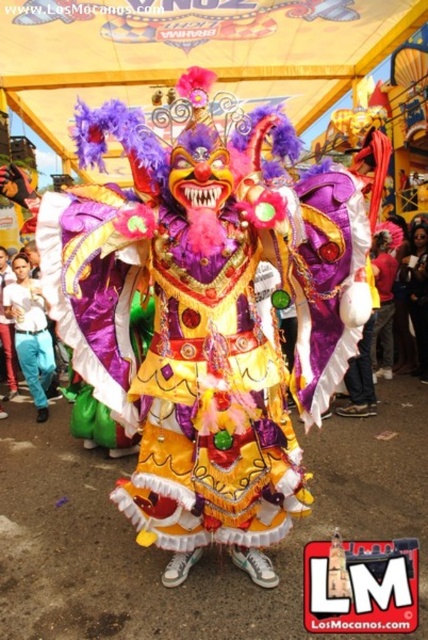
You are organizing a costume party and need to decide which outfit to wear. You have the white cotton shirt at lower left and the matte purple costume at center. Which one is smaller in size?

The white cotton shirt at lower left has a smaller size compared to the matte purple costume at center, so the white cotton shirt at lower left is the smaller one.

You are a photographer setting up for a cultural event. You need to position a spotlight so it illuminates both the white cotton shirt at lower left and the matte purple costume at center without overlapping their light areas. Given their positions, which object should you place the spotlight closer to?

The white cotton shirt at lower left is to the left of the matte purple costume at center, so you should place the spotlight closer to the matte purple costume at center to ensure both receive light without overlapping their illuminated areas.

You are a photographer setting up for a cultural event. You need to capture a shot where both the white cotton shirt at lower left and the matte purple costume at center are in focus. Given that your camera can only focus on objects within a 10 feet range, will you be able to achieve this?

The white cotton shirt at lower left and the matte purple costume at center are 9.43 feet apart. Since the distance between them is within the 10 feet range, the camera can focus on both objects simultaneously.